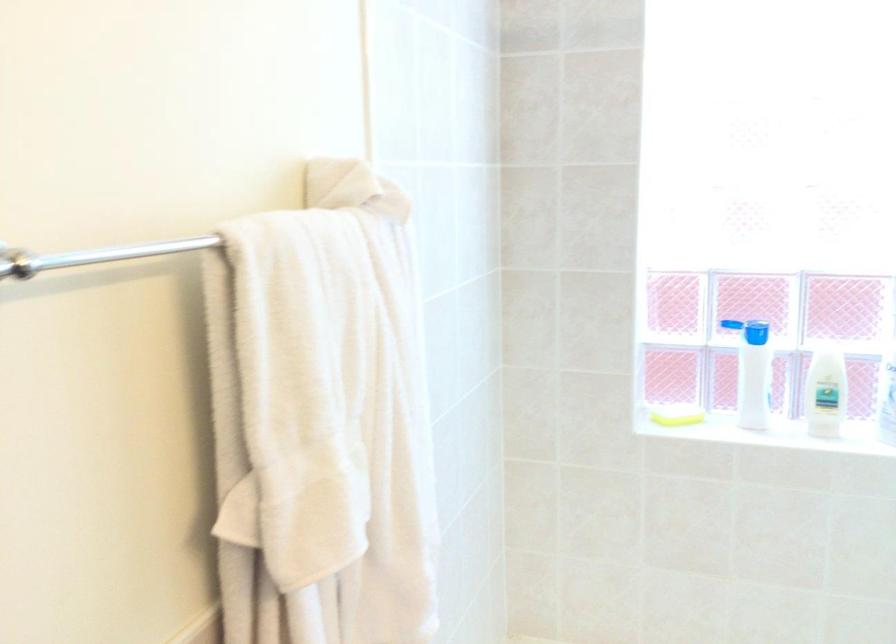
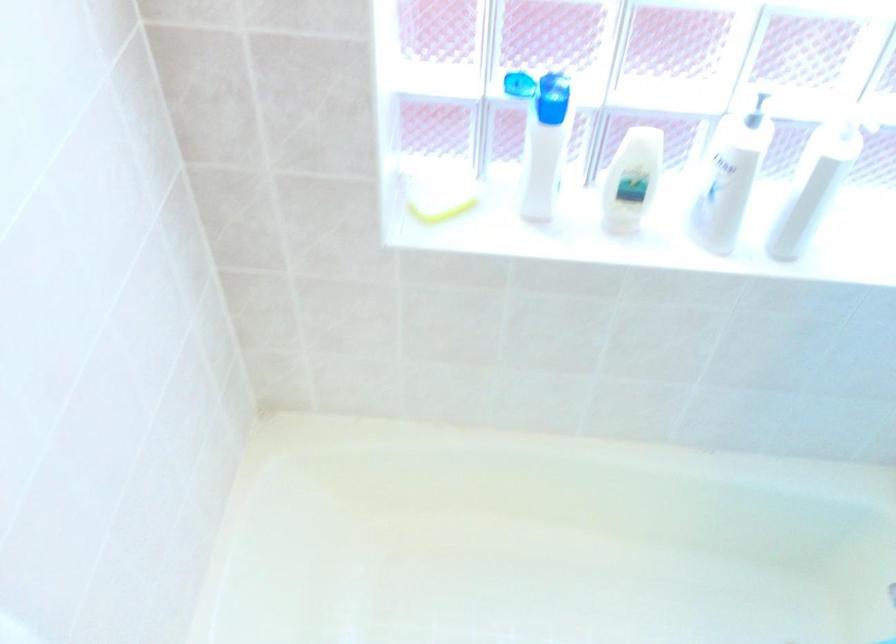
Locate, in the second image, the point that corresponds to pixel 676 415 in the first image.

(438, 196)